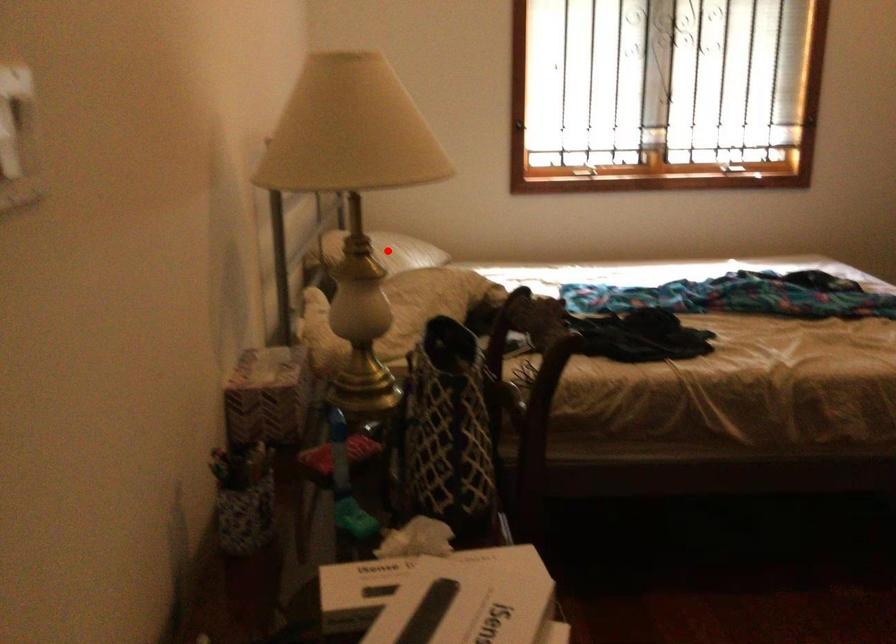
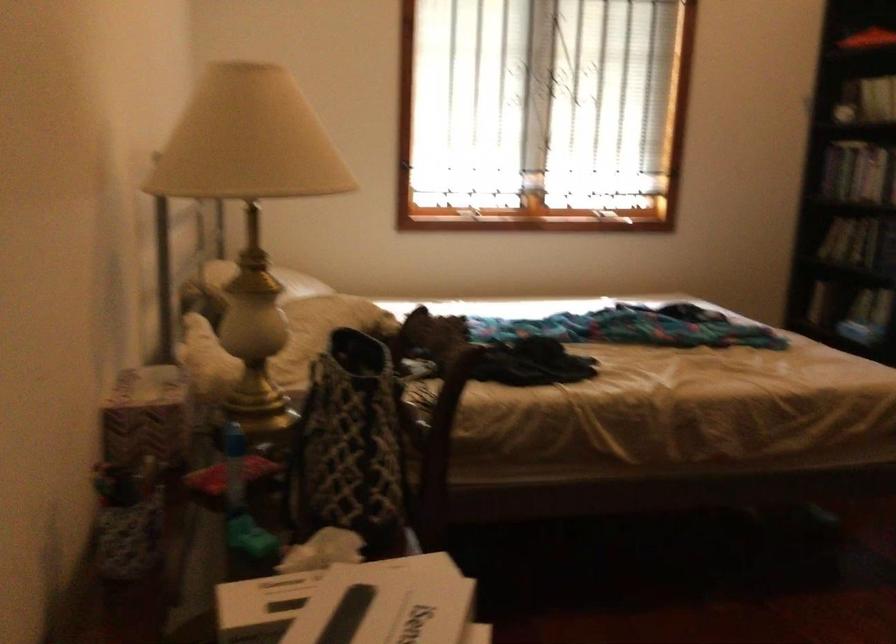
Question: I am providing you with two images of the same scene from different viewpoints. A red point is marked on the first image. Is the red point's position out of view in image 2?

Choices:
 (A) Yes
 (B) No

Answer: (A)